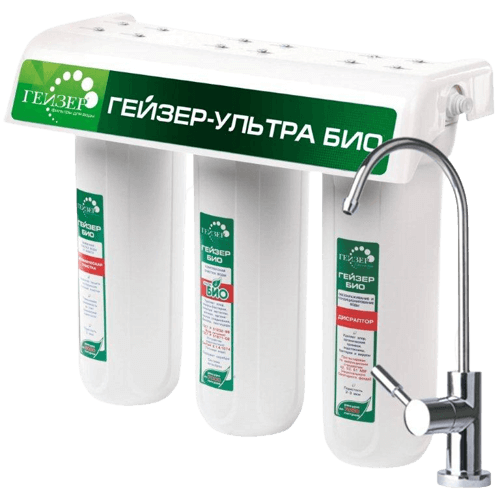
Where is `faucet`? faucet is located at coordinates (448, 388).